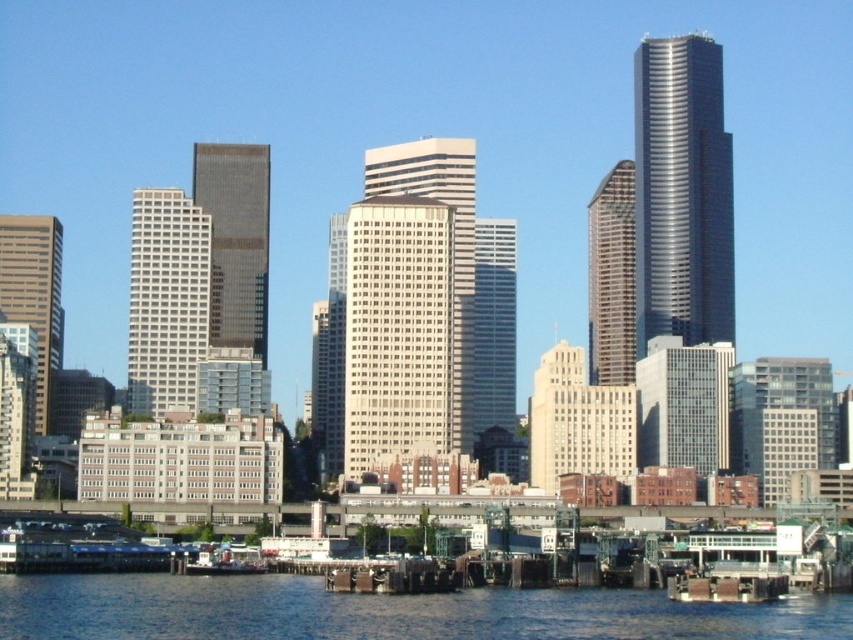
Who is more forward, (842, 611) or (633, 196)?

Point (842, 611) is in front.

Between point (381, 608) and point (613, 336), which one is positioned behind?

The point (613, 336) is more distant.

You are a GUI agent. You are given a task and a screenshot of the screen. Output one action in this format:
    pyautogui.click(x=<x>, y=<y>)
    Task: Click on the blue water at lower center
    This screenshot has width=853, height=640.
    Given the screenshot: What is the action you would take?
    pyautogui.click(x=384, y=611)

Does silver metallic skyscraper at upper right appear over matte glass skyscraper at center?

Yes.

Is silver metallic skyscraper at upper right positioned at the back of matte glass skyscraper at center?

Yes.

Is point (689, 259) positioned after point (498, 323)?

No, it is in front of (498, 323).

The height and width of the screenshot is (640, 853). I want to click on silver metallic skyscraper at upper right, so 682,193.

Which is in front, point (634, 170) or point (186, 557)?

Point (186, 557) is in front.

How far apart are gray glass skyscraper at center and metallic gray boat at lower left?

A distance of 90.47 meters exists between gray glass skyscraper at center and metallic gray boat at lower left.

Is point (624, 321) farther from camera compared to point (189, 568)?

Yes, point (624, 321) is behind point (189, 568).

At what (x,y) coordinates should I click in order to perform the action: click on gray glass skyscraper at center. Please return your answer as a coordinate pair (x, y). Image resolution: width=853 pixels, height=640 pixels. Looking at the image, I should click on (611, 276).